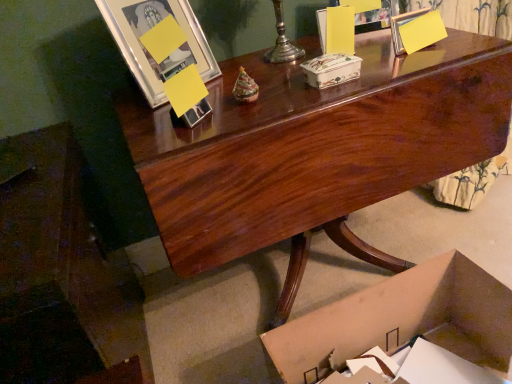
Question: Does matte silver picture frame at upper center, the 1th picture frame when ordered from back to front, have a lesser height compared to cardboard box at lower right, the first box when ordered from bottom to top?

Choices:
 (A) yes
 (B) no

Answer: (A)

Question: Considering the relative sizes of matte silver picture frame at upper center, which is the first picture frame from right to left, and cardboard box at lower right, the first box when ordered from bottom to top, in the image provided, is matte silver picture frame at upper center, which is the first picture frame from right to left, bigger than cardboard box at lower right, the first box when ordered from bottom to top,?

Choices:
 (A) no
 (B) yes

Answer: (A)

Question: Does matte silver picture frame at upper center, which is the first picture frame from right to left, come in front of cardboard box at lower right, placed as the 2th box when sorted from top to bottom?

Choices:
 (A) yes
 (B) no

Answer: (B)

Question: From a real-world perspective, is matte silver picture frame at upper center, the second picture frame viewed from the front, beneath cardboard box at lower right, placed as the 2th box when sorted from top to bottom?

Choices:
 (A) no
 (B) yes

Answer: (A)

Question: Is matte silver picture frame at upper center, the 1th picture frame when ordered from back to front, smaller than cardboard box at lower right, the first box when ordered from bottom to top?

Choices:
 (A) no
 (B) yes

Answer: (B)

Question: Is matte silver picture frame at upper center, which is the first picture frame from right to left, at the right side of cardboard box at lower right, placed as the 2th box when sorted from top to bottom?

Choices:
 (A) yes
 (B) no

Answer: (B)

Question: Is porcelain floral box at center, the second box when ordered from bottom to top, closer to the viewer compared to metallic silver picture frame at upper left, marked as the 2th picture frame in a back-to-front arrangement?

Choices:
 (A) yes
 (B) no

Answer: (B)

Question: Can you confirm if porcelain floral box at center, the second box when ordered from bottom to top, is thinner than metallic silver picture frame at upper left, positioned as the first picture frame in front-to-back order?

Choices:
 (A) yes
 (B) no

Answer: (A)

Question: Considering the relative sizes of porcelain floral box at center, which ranks as the 1th box in top-to-bottom order, and metallic silver picture frame at upper left, marked as the 2th picture frame in a back-to-front arrangement, in the image provided, is porcelain floral box at center, which ranks as the 1th box in top-to-bottom order, smaller than metallic silver picture frame at upper left, marked as the 2th picture frame in a back-to-front arrangement,?

Choices:
 (A) yes
 (B) no

Answer: (A)

Question: Is porcelain floral box at center, which ranks as the 1th box in top-to-bottom order, far away from metallic silver picture frame at upper left, positioned as the first picture frame in front-to-back order?

Choices:
 (A) no
 (B) yes

Answer: (A)

Question: Is metallic silver picture frame at upper left, marked as the 2th picture frame in a back-to-front arrangement, at the back of porcelain floral box at center, which ranks as the 1th box in top-to-bottom order?

Choices:
 (A) yes
 (B) no

Answer: (B)

Question: Can you confirm if porcelain floral box at center, which ranks as the 1th box in top-to-bottom order, is wider than metallic silver picture frame at upper left, positioned as the first picture frame in front-to-back order?

Choices:
 (A) no
 (B) yes

Answer: (A)

Question: From a real-world perspective, does cardboard box at lower right, the first box when ordered from bottom to top, sit lower than glossy wood desk at center?

Choices:
 (A) yes
 (B) no

Answer: (A)